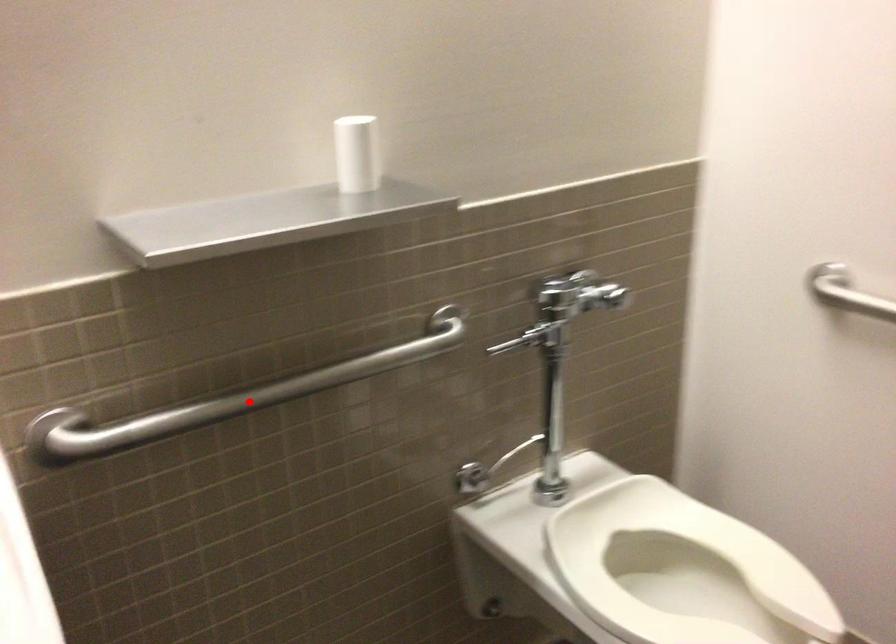
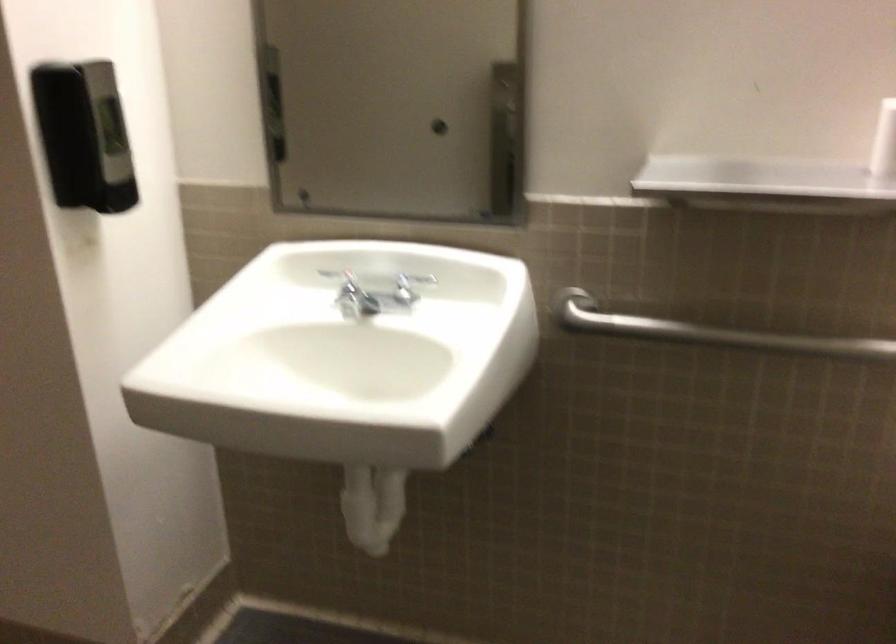
The point at the highlighted location is marked in the first image. Where is the corresponding point in the second image?

(707, 332)